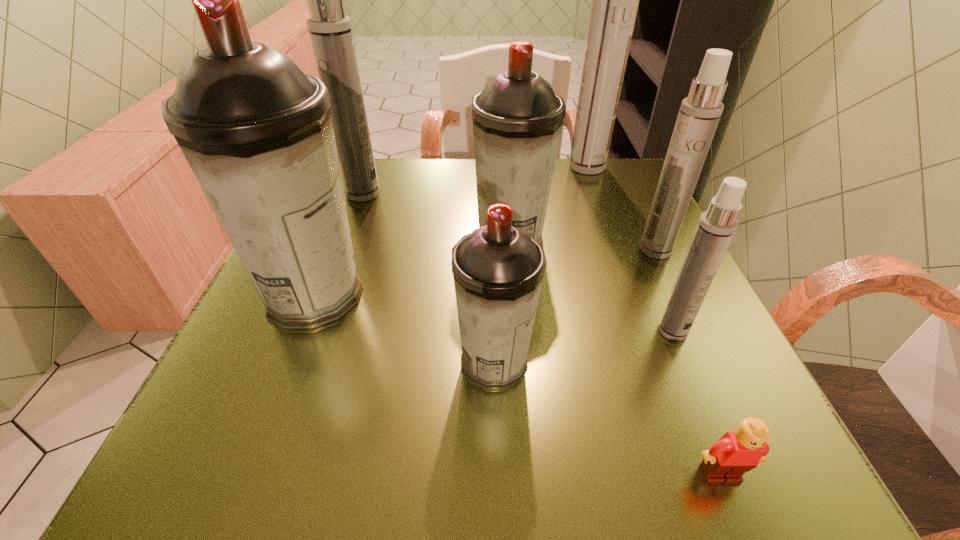
Find the location of a particular element. This screenshot has height=540, width=960. object that is positioned at the far left corner is located at coordinates (330, 30).

At what (x,y) coordinates should I click in order to perform the action: click on object that is at the far right corner. Please return your answer as a coordinate pair (x, y). Looking at the image, I should click on (615, 0).

Where is `object located in the near right corner section of the desktop`? This screenshot has width=960, height=540. object located in the near right corner section of the desktop is located at coordinates (736, 452).

The image size is (960, 540). What are the coordinates of `blank area at the far edge` in the screenshot? It's located at (392, 198).

In the image, there is a desktop. Where is `blank space at the near edge`? blank space at the near edge is located at coordinates (577, 455).

This screenshot has width=960, height=540. In the image, there is a desktop. In order to click on free space at the left edge in this screenshot , I will do `click(354, 231)`.

In the image, there is a desktop. Identify the location of free space at the right edge. This screenshot has height=540, width=960. (637, 255).

This screenshot has height=540, width=960. I want to click on vacant space at the near left corner of the desktop, so click(x=252, y=422).

The width and height of the screenshot is (960, 540). What are the coordinates of `free space at the far right corner of the desktop` in the screenshot? It's located at (626, 184).

Find the location of a particular element. This screenshot has width=960, height=540. free region at the near right corner is located at coordinates (756, 474).